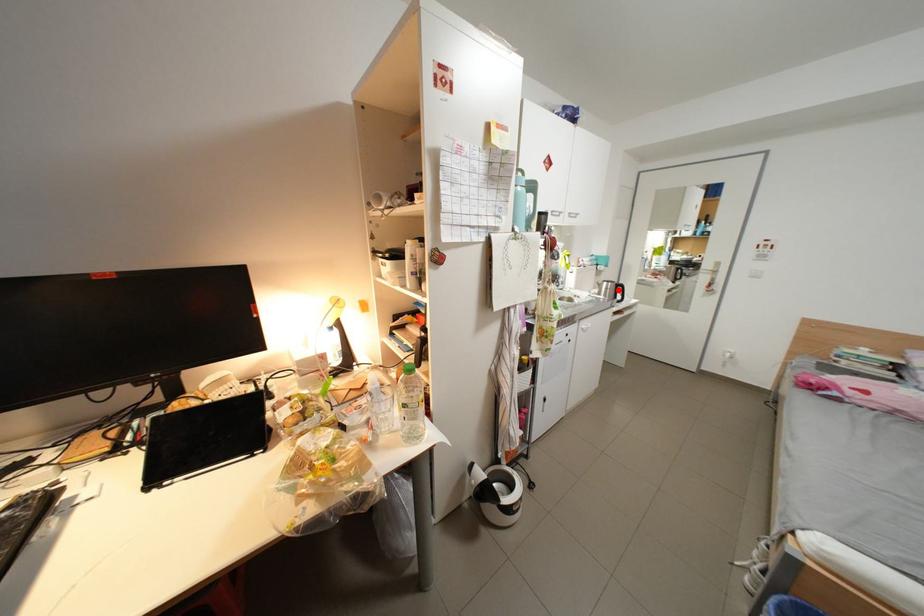
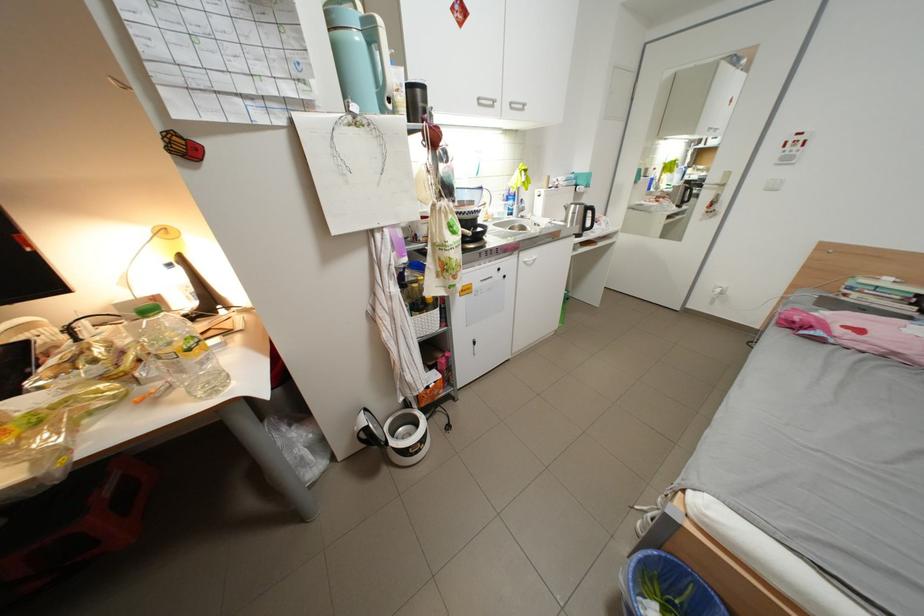
Question: I am providing you with two images of the same scene from different viewpoints. A red point is shown in image1. For the corresponding object point in image2, is it positioned nearer or farther from the camera?

Choices:
 (A) Nearer
 (B) Farther

Answer: (A)